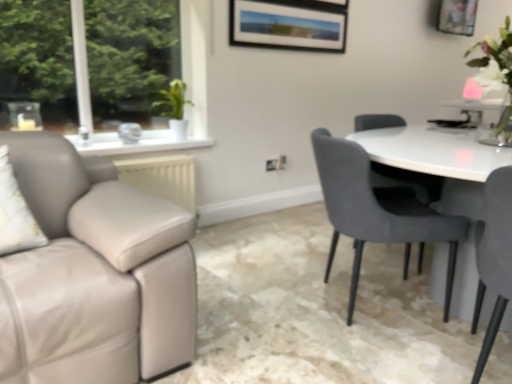
This screenshot has height=384, width=512. Describe the element at coordinates (496, 77) in the screenshot. I see `white glossy vase at upper right` at that location.

Locate an element on the screen. The image size is (512, 384). white glossy vase at upper right is located at coordinates (496, 77).

Could you tell me if white glossy vase at upper right is turned towards matte gray chair at right, which is the first chair from front to back?

No, white glossy vase at upper right is not aimed at matte gray chair at right, which is the first chair from front to back.

Between white glossy vase at upper right and matte gray chair at right, which is the first chair from front to back, which one is positioned in front?

matte gray chair at right, which is the first chair from front to back, is more forward.

Which is closer, (485, 54) or (510, 176)?

The point (510, 176) is more forward.

Image resolution: width=512 pixels, height=384 pixels. Find the location of `the 1st chair counting from the left of the white glossy vase at upper right`. the 1st chair counting from the left of the white glossy vase at upper right is located at coordinates (494, 256).

Considering the sizes of objects matte gray chair at right, the second chair viewed from the back, and wooden picture frame at upper right in the image provided, who is shorter, matte gray chair at right, the second chair viewed from the back, or wooden picture frame at upper right?

With less height is wooden picture frame at upper right.

In the image, is matte gray chair at right, the second chair viewed from the back, on the left side or the right side of wooden picture frame at upper right?

matte gray chair at right, the second chair viewed from the back, is positioned on wooden picture frame at upper right's left side.

In the image, is matte gray chair at right, the second chair viewed from the back, positioned in front of or behind wooden picture frame at upper right?

Visually, matte gray chair at right, the second chair viewed from the back, is located in front of wooden picture frame at upper right.

In the scene shown: From the image's perspective, does matte gray chair at right, which is the first chair from front to back, appear lower than wooden picture frame at upper right?

Yes, from the image's perspective, matte gray chair at right, which is the first chair from front to back, is below wooden picture frame at upper right.

From a real-world perspective, is wooden picture frame at upper right beneath white glossy vase at upper right?

No.

Can you confirm if wooden picture frame at upper right is bigger than white glossy vase at upper right?

No.

In the scene shown: Could you tell me if wooden picture frame at upper right is turned towards white glossy vase at upper right?

No, wooden picture frame at upper right is not aimed at white glossy vase at upper right.

Is wooden picture frame at upper right to the right of white glossy vase at upper right from the viewer's perspective?

Correct, you'll find wooden picture frame at upper right to the right of white glossy vase at upper right.

Are matte gray chair at right, the second chair viewed from the back, and white glossy vase at upper right located far from each other?

They are positioned close to each other.

Is white glossy vase at upper right at the back of matte gray chair at right, the second chair viewed from the back?

No, matte gray chair at right, the second chair viewed from the back, is not facing away from white glossy vase at upper right.

Does matte gray chair at right, the second chair viewed from the back, have a smaller size compared to white glossy vase at upper right?

Incorrect, matte gray chair at right, the second chair viewed from the back, is not smaller in size than white glossy vase at upper right.

From the image's perspective, which is above, matte gray chair at right, the second chair viewed from the back, or white glossy vase at upper right?

white glossy vase at upper right is shown above in the image.

Could you tell me if velvet grey chair at right, which is the 2th chair from front to back, is turned towards wooden picture frame at upper right?

No, velvet grey chair at right, which is the 2th chair from front to back, is not aimed at wooden picture frame at upper right.

Would you say velvet grey chair at right, the 1th chair positioned from the back, is inside or outside wooden picture frame at upper right?

velvet grey chair at right, the 1th chair positioned from the back, exists outside the volume of wooden picture frame at upper right.

Which of these two, velvet grey chair at right, which is the 2th chair from front to back, or wooden picture frame at upper right, is bigger?

velvet grey chair at right, which is the 2th chair from front to back.

Could you measure the distance between velvet grey chair at right, which is the 2th chair from front to back, and wooden picture frame at upper right?

9.93 feet.

From a real-world perspective, is wooden picture frame at upper right physically below velvet grey chair at right, which is the 2th chair from front to back?

No, from a real-world perspective, wooden picture frame at upper right is not beneath velvet grey chair at right, which is the 2th chair from front to back.

Considering the sizes of objects wooden picture frame at upper right and velvet grey chair at right, which is the 2th chair from front to back, in the image provided, who is wider, wooden picture frame at upper right or velvet grey chair at right, which is the 2th chair from front to back,?

velvet grey chair at right, which is the 2th chair from front to back, is wider.

Which is more to the left, wooden picture frame at upper right or velvet grey chair at right, which is the 2th chair from front to back?

From the viewer's perspective, velvet grey chair at right, which is the 2th chair from front to back, appears more on the left side.

Does point (471, 16) lie in front of point (338, 196)?

No.

What are the coordinates of `picture frame located on the right of matte gray chair at right, the second chair viewed from the back` in the screenshot? It's located at (457, 17).

How many degrees apart are the facing directions of wooden picture frame at upper right and matte gray chair at right, the second chair viewed from the back?

The angular difference between wooden picture frame at upper right and matte gray chair at right, the second chair viewed from the back, is 113 degrees.

Measure the distance between wooden picture frame at upper right and matte gray chair at right, the second chair viewed from the back.

They are 3.40 meters apart.

Is matte gray chair at right, which is the first chair from front to back, at the back of wooden picture frame at upper right?

That's not correct — wooden picture frame at upper right is not looking away from matte gray chair at right, which is the first chair from front to back.

The width and height of the screenshot is (512, 384). I want to click on floral arrangement positioned vertically above the matte gray chair at right, which is the first chair from front to back (from a real-world perspective), so click(496, 77).

From the image's perspective, starting from the wooden picture frame at upper right, which chair is the 2nd one below? Please provide its 2D coordinates.

[(494, 256)]

Estimate the real-world distances between objects in this image. Which object is closer to wooden picture frame at upper right, white glossy vase at upper right or velvet grey chair at right, which is the 2th chair from front to back?

The object closer to wooden picture frame at upper right is white glossy vase at upper right.

Estimate the real-world distances between objects in this image. Which object is closer to velvet grey chair at right, the 1th chair positioned from the back, white glossy vase at upper right or wooden picture frame at upper right?

Based on the image, white glossy vase at upper right appears to be nearer to velvet grey chair at right, the 1th chair positioned from the back.

Based on their spatial positions, is velvet grey chair at right, which is the 2th chair from front to back, or wooden picture frame at upper right further from white glossy vase at upper right?

wooden picture frame at upper right.

Based on their spatial positions, is matte gray chair at right, which is the first chair from front to back, or white glossy vase at upper right further from velvet grey chair at right, the 1th chair positioned from the back?

white glossy vase at upper right.

Based on their spatial positions, is matte gray chair at right, which is the first chair from front to back, or wooden picture frame at upper right closer to velvet grey chair at right, which is the 2th chair from front to back?

Based on the image, matte gray chair at right, which is the first chair from front to back, appears to be nearer to velvet grey chair at right, which is the 2th chair from front to back.

Estimate the real-world distances between objects in this image. Which object is closer to matte gray chair at right, which is the first chair from front to back, white glossy vase at upper right or wooden picture frame at upper right?

The object closer to matte gray chair at right, which is the first chair from front to back, is white glossy vase at upper right.

Which object lies further to the anchor point wooden picture frame at upper right, velvet grey chair at right, which is the 2th chair from front to back, or white glossy vase at upper right?

The object further to wooden picture frame at upper right is velvet grey chair at right, which is the 2th chair from front to back.

Looking at the image, which one is located closer to wooden picture frame at upper right, white glossy vase at upper right or matte gray chair at right, which is the first chair from front to back?

Among the two, white glossy vase at upper right is located nearer to wooden picture frame at upper right.

This screenshot has width=512, height=384. Find the location of `floral arrangement located between matte gray chair at right, which is the first chair from front to back, and wooden picture frame at upper right in the depth direction`. floral arrangement located between matte gray chair at right, which is the first chair from front to back, and wooden picture frame at upper right in the depth direction is located at coordinates pyautogui.click(x=496, y=77).

Where is `chair located between matte gray chair at right, which is the first chair from front to back, and wooden picture frame at upper right in the depth direction`? The image size is (512, 384). chair located between matte gray chair at right, which is the first chair from front to back, and wooden picture frame at upper right in the depth direction is located at coordinates (377, 211).

The height and width of the screenshot is (384, 512). I want to click on chair between white glossy vase at upper right and matte gray chair at right, the second chair viewed from the back, in the up-down direction, so [377, 211].

Identify the location of floral arrangement between velvet grey chair at right, the 1th chair positioned from the back, and wooden picture frame at upper right from front to back. The image size is (512, 384). (496, 77).